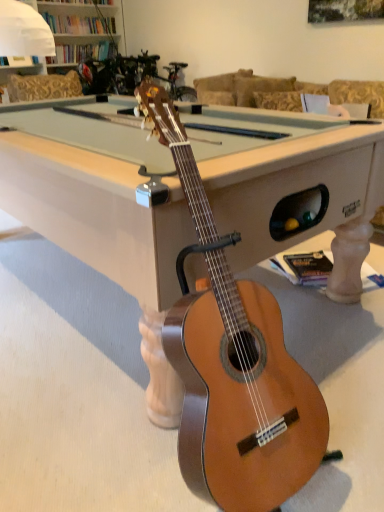
What do you see at coordinates (233, 365) in the screenshot?
I see `natural wood guitar at center` at bounding box center [233, 365].

Identify the location of natural wood guitar at center. coord(233,365).

The height and width of the screenshot is (512, 384). What are the coordinates of `light wood billiard table at center` in the screenshot? It's located at (98, 212).

The width and height of the screenshot is (384, 512). Describe the element at coordinates (98, 212) in the screenshot. I see `light wood billiard table at center` at that location.

This screenshot has width=384, height=512. In order to click on natural wood guitar at center in this screenshot , I will do (233, 365).

Considering the relative positions of light wood billiard table at center and natural wood guitar at center in the image provided, is light wood billiard table at center to the left or to the right of natural wood guitar at center?

light wood billiard table at center is positioned on natural wood guitar at center's left side.

Is light wood billiard table at center in front of or behind natural wood guitar at center in the image?

Clearly, light wood billiard table at center is behind natural wood guitar at center.

Does point (231, 212) come closer to viewer compared to point (238, 416)?

No, (231, 212) is further to viewer.

From the image's perspective, which is below, light wood billiard table at center or natural wood guitar at center?

natural wood guitar at center appears lower in the image.

From a real-world perspective, which is physically below, light wood billiard table at center or natural wood guitar at center?

From a 3D spatial view, light wood billiard table at center is below.

Considering the sizes of objects light wood billiard table at center and natural wood guitar at center in the image provided, who is wider, light wood billiard table at center or natural wood guitar at center?

light wood billiard table at center is wider.

Which of these two, light wood billiard table at center or natural wood guitar at center, stands shorter?

With less height is light wood billiard table at center.

Does light wood billiard table at center have a smaller size compared to natural wood guitar at center?

Incorrect, light wood billiard table at center is not smaller in size than natural wood guitar at center.

Do you think light wood billiard table at center is within natural wood guitar at center, or outside of it?

light wood billiard table at center exists outside the volume of natural wood guitar at center.

Is light wood billiard table at center beside natural wood guitar at center?

→ No, light wood billiard table at center is not in contact with natural wood guitar at center.

Could you tell me if light wood billiard table at center is turned towards natural wood guitar at center?

No, light wood billiard table at center is not oriented towards natural wood guitar at center.

How many degrees apart are the facing directions of light wood billiard table at center and natural wood guitar at center?

They differ by 1.19 degrees in their facing directions.

Find the location of `guitar below the light wood billiard table at center (from the image's perspective)`. guitar below the light wood billiard table at center (from the image's perspective) is located at coordinates (233, 365).

Which object is positioned more to the left, natural wood guitar at center or light wood billiard table at center?

light wood billiard table at center.

Is natural wood guitar at center in front of or behind light wood billiard table at center in the image?

In the image, natural wood guitar at center appears in front of light wood billiard table at center.

Does point (192, 337) lie behind point (259, 184)?

That is False.

In the scene shown: From the image's perspective, which object appears higher, natural wood guitar at center or light wood billiard table at center?

light wood billiard table at center is shown above in the image.

From a real-world perspective, which object rests below the other?

light wood billiard table at center, from a real-world perspective.

Is natural wood guitar at center wider than light wood billiard table at center?

No.

Considering the sizes of objects natural wood guitar at center and light wood billiard table at center in the image provided, who is shorter, natural wood guitar at center or light wood billiard table at center?

Standing shorter between the two is light wood billiard table at center.

In terms of size, does natural wood guitar at center appear bigger or smaller than light wood billiard table at center?

Considering their sizes, natural wood guitar at center takes up less space than light wood billiard table at center.

Is natural wood guitar at center inside the boundaries of light wood billiard table at center, or outside?

natural wood guitar at center is outside light wood billiard table at center.

Are natural wood guitar at center and light wood billiard table at center far apart?

That's not correct — natural wood guitar at center is a little close to light wood billiard table at center.

Is natural wood guitar at center oriented away from light wood billiard table at center?

No.

How far apart are natural wood guitar at center and light wood billiard table at center?

13.02 inches.

Image resolution: width=384 pixels, height=512 pixels. I want to click on billiard table above the natural wood guitar at center (from the image's perspective), so click(98, 212).

Identify the location of guitar in front of the light wood billiard table at center. pyautogui.click(x=233, y=365).

The width and height of the screenshot is (384, 512). What are the coordinates of `billiard table below the natural wood guitar at center (from a real-world perspective)` in the screenshot? It's located at pos(98,212).